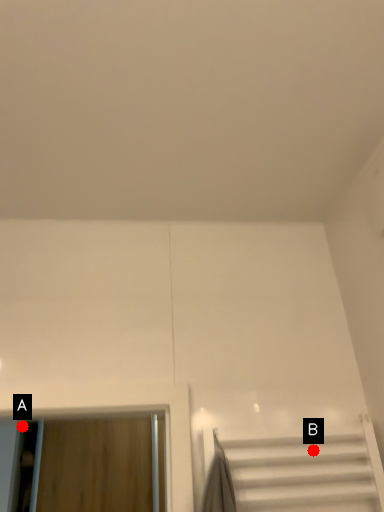
Question: Two points are circled on the image, labeled by A and B beside each circle. Among these points, which one is nearest to the camera?

Choices:
 (A) A is closer
 (B) B is closer

Answer: (B)